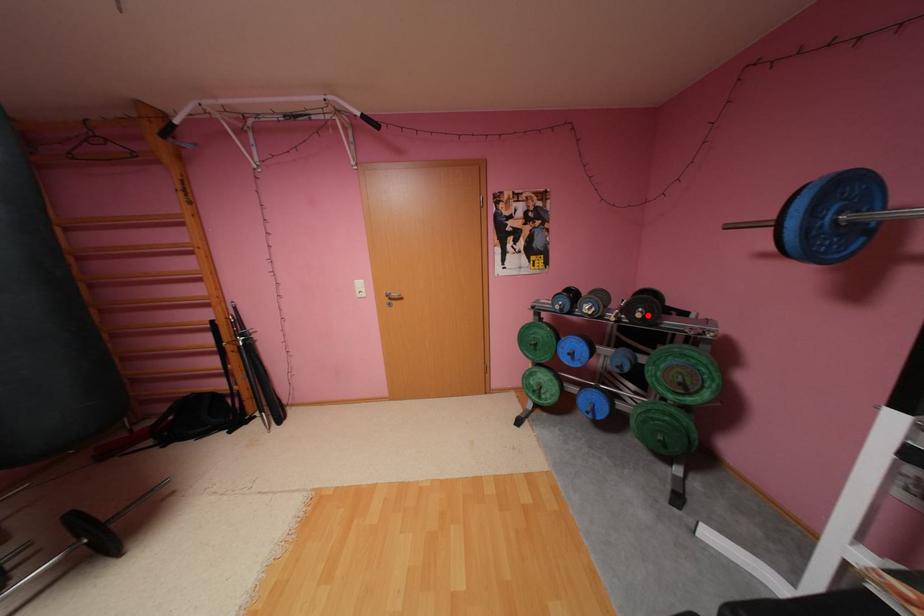
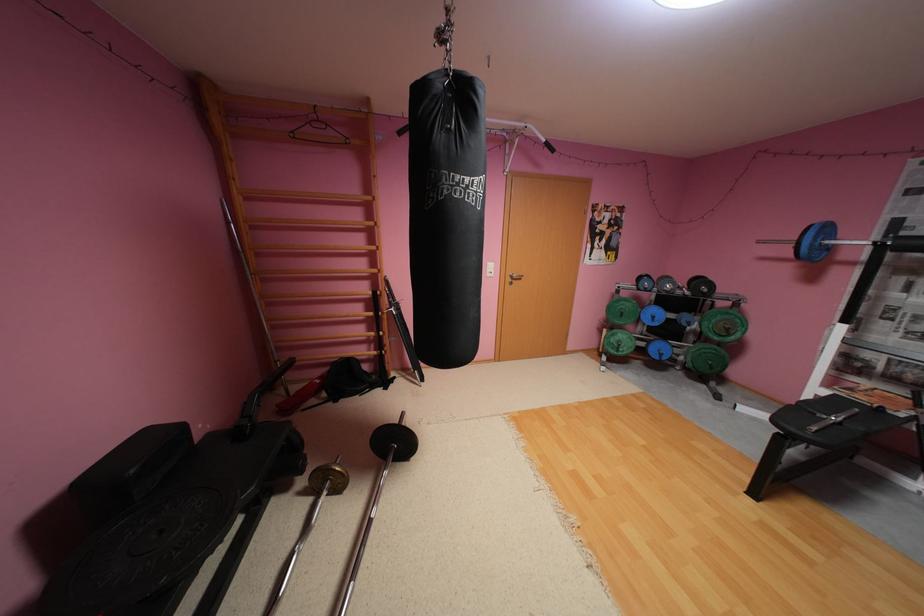
Question: I am providing you with two images of the same scene from different viewpoints. A red point is marked on the first image. Is the red point's position out of view in image 2?

Choices:
 (A) Yes
 (B) No

Answer: (B)